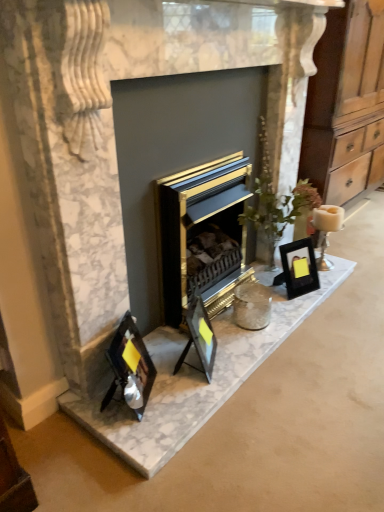
What is the approximate height of black glass photo frames at lower left?

The height of black glass photo frames at lower left is 10.00 centimeters.

I want to click on black glass photo frames at lower left, so click(194, 380).

What do you see at coordinates (130, 367) in the screenshot? I see `metallic silver photo frame at lower left, which is the third picture frame in right-to-left order` at bounding box center [130, 367].

Locate an element on the screen. Image resolution: width=384 pixels, height=512 pixels. white ceramic candle at right is located at coordinates (326, 229).

Based on the photo, is matte black picture frame at center, acting as the 2th picture frame starting from the back, not near black glass photo frames at lower left?

No, matte black picture frame at center, acting as the 2th picture frame starting from the back, is in close proximity to black glass photo frames at lower left.

Is matte black picture frame at center, the 2th picture frame from the left, bigger than black glass photo frames at lower left?

Correct, matte black picture frame at center, the 2th picture frame from the left, is larger in size than black glass photo frames at lower left.

How different are the orientations of matte black picture frame at center, the 2th picture frame from the right, and black glass photo frames at lower left in degrees?

They differ by 28.7 degrees in their facing directions.

Considering the positions of objects matte black picture frame at center, placed as the second picture frame when sorted from front to back, and black glass photo frames at lower left in the image provided, who is more to the left, matte black picture frame at center, placed as the second picture frame when sorted from front to back, or black glass photo frames at lower left?

From the viewer's perspective, black glass photo frames at lower left appears more on the left side.

Is black glass photo frame at center, which is the 3th picture frame in front-to-back order, spatially inside gold metallic fireplace at center, or outside of it?

The correct answer is: outside.

From the image's perspective, is black glass photo frame at center, the 3th picture frame positioned from the left, located above or below gold metallic fireplace at center?

black glass photo frame at center, the 3th picture frame positioned from the left, is situated lower than gold metallic fireplace at center in the image.

Can you tell me how much black glass photo frame at center, the 3th picture frame positioned from the left, and gold metallic fireplace at center differ in facing direction?

The angle between the facing direction of black glass photo frame at center, the 3th picture frame positioned from the left, and the facing direction of gold metallic fireplace at center is 21.2 degrees.

Is black glass photo frame at center, which appears as the 1th picture frame when viewed from the right, taller than gold metallic fireplace at center?

No, black glass photo frame at center, which appears as the 1th picture frame when viewed from the right, is not taller than gold metallic fireplace at center.

From a real-world perspective, is matte black picture frame at center, the 2th picture frame from the left, on gold metallic fireplace at center?

No.

Is matte black picture frame at center, the 2th picture frame from the right, aimed at gold metallic fireplace at center?

No, matte black picture frame at center, the 2th picture frame from the right, is not aimed at gold metallic fireplace at center.

Could you tell me if white ceramic candle at right is turned towards matte black picture frame at center, the 2th picture frame from the right?

No.

Considering their positions, is white ceramic candle at right located in front of or behind matte black picture frame at center, acting as the 2th picture frame starting from the back?

In the image, white ceramic candle at right appears behind matte black picture frame at center, acting as the 2th picture frame starting from the back.

From a real-world perspective, who is located higher, white ceramic candle at right or matte black picture frame at center, placed as the second picture frame when sorted from front to back?

white ceramic candle at right, from a real-world perspective.

Is white ceramic candle at right positioned beyond the bounds of matte black picture frame at center, the 2th picture frame from the left?

Yes, white ceramic candle at right is located beyond the bounds of matte black picture frame at center, the 2th picture frame from the left.

Is black glass photo frames at lower left not within black glass photo frame at center, which appears as the 1th picture frame when viewed from the right?

Absolutely, black glass photo frames at lower left is external to black glass photo frame at center, which appears as the 1th picture frame when viewed from the right.

From the image's perspective, is black glass photo frames at lower left located above or below black glass photo frame at center, which appears as the 1th picture frame when viewed from the right?

Based on their image positions, black glass photo frames at lower left is located beneath black glass photo frame at center, which appears as the 1th picture frame when viewed from the right.

Which object is positioned more to the right, black glass photo frames at lower left or black glass photo frame at center, which appears as the 1th picture frame when viewed from the right?

black glass photo frame at center, which appears as the 1th picture frame when viewed from the right.

Considering the sizes of black glass photo frames at lower left and black glass photo frame at center, which appears as the 1th picture frame when viewed from the right, in the image, is black glass photo frames at lower left bigger or smaller than black glass photo frame at center, which appears as the 1th picture frame when viewed from the right,?

In the image, black glass photo frames at lower left appears to be smaller than black glass photo frame at center, which appears as the 1th picture frame when viewed from the right.

Is metallic silver photo frame at lower left, arranged as the first picture frame when viewed from the front, touching wooden dresser at right?

metallic silver photo frame at lower left, arranged as the first picture frame when viewed from the front, and wooden dresser at right are clearly separated.

Is metallic silver photo frame at lower left, arranged as the first picture frame when viewed from the front, turned away from wooden dresser at right?

No, metallic silver photo frame at lower left, arranged as the first picture frame when viewed from the front, is not facing away from wooden dresser at right.

The height and width of the screenshot is (512, 384). Find the location of `the 3rd picture frame positioned below the wooden dresser at right (from the image's perspective)`. the 3rd picture frame positioned below the wooden dresser at right (from the image's perspective) is located at coordinates (130, 367).

Considering the positions of objects metallic silver photo frame at lower left, the 3th picture frame in the back-to-front sequence, and wooden dresser at right in the image provided, who is more to the right, metallic silver photo frame at lower left, the 3th picture frame in the back-to-front sequence, or wooden dresser at right?

From the viewer's perspective, wooden dresser at right appears more on the right side.

From a real-world perspective, is wooden dresser at right located beneath gold metallic fireplace at center?

No, from a real-world perspective, wooden dresser at right is not under gold metallic fireplace at center.

Is wooden dresser at right behind gold metallic fireplace at center?

Yes, it is.

Are wooden dresser at right and gold metallic fireplace at center far apart?

Actually, wooden dresser at right and gold metallic fireplace at center are a little close together.

From the image's perspective, is wooden dresser at right on gold metallic fireplace at center?

Correct, wooden dresser at right appears higher than gold metallic fireplace at center in the image.

The height and width of the screenshot is (512, 384). I want to click on table that appears in front of the matte black picture frame at center, placed as the second picture frame when sorted from front to back, so click(194, 380).

The width and height of the screenshot is (384, 512). Identify the location of picture frame that appears behind the gold metallic fireplace at center. (298, 268).

Based on their spatial positions, is black glass photo frames at lower left or gold metallic fireplace at center closer to metallic silver photo frame at lower left, arranged as the first picture frame when viewed from the front?

The object closer to metallic silver photo frame at lower left, arranged as the first picture frame when viewed from the front, is black glass photo frames at lower left.

When comparing their distances from metallic silver photo frame at lower left, acting as the first picture frame starting from the left, does black glass photo frames at lower left or wooden dresser at right seem closer?

black glass photo frames at lower left.

Considering their positions, is black glass photo frame at center, which appears as the 1th picture frame when viewed from the right, positioned further to matte black picture frame at center, acting as the 2th picture frame starting from the back, than wooden dresser at right?

wooden dresser at right is positioned further to the anchor matte black picture frame at center, acting as the 2th picture frame starting from the back.

From the image, which object appears to be farther from matte black picture frame at center, placed as the second picture frame when sorted from front to back, black glass photo frames at lower left or metallic silver photo frame at lower left, which is the third picture frame in right-to-left order?

Among the two, metallic silver photo frame at lower left, which is the third picture frame in right-to-left order, is located further to matte black picture frame at center, placed as the second picture frame when sorted from front to back.

From the image, which object appears to be farther from black glass photo frames at lower left, gold metallic fireplace at center or wooden dresser at right?

Based on the image, wooden dresser at right appears to be further to black glass photo frames at lower left.

Estimate the real-world distances between objects in this image. Which object is further from gold metallic fireplace at center, white ceramic candle at right or black glass photo frames at lower left?

white ceramic candle at right is further to gold metallic fireplace at center.

Estimate the real-world distances between objects in this image. Which object is closer to black glass photo frame at center, the 3th picture frame positioned from the left, wooden dresser at right or matte black picture frame at center, the 2th picture frame from the left?

matte black picture frame at center, the 2th picture frame from the left, is closer to black glass photo frame at center, the 3th picture frame positioned from the left.

Based on their spatial positions, is matte black picture frame at center, placed as the second picture frame when sorted from front to back, or gold metallic fireplace at center further from black glass photo frames at lower left?

Among the two, gold metallic fireplace at center is located further to black glass photo frames at lower left.

Where is `picture frame between wooden dresser at right and matte black picture frame at center, the 2th picture frame from the right, in the up-down direction`? This screenshot has width=384, height=512. picture frame between wooden dresser at right and matte black picture frame at center, the 2th picture frame from the right, in the up-down direction is located at coordinates (298, 268).

The image size is (384, 512). What are the coordinates of `fireplace between black glass photo frames at lower left and black glass photo frame at center, which is the 3th picture frame in front-to-back order, from left to right` in the screenshot? It's located at (202, 236).

In order to click on fireplace located between black glass photo frames at lower left and white ceramic candle at right in the left-right direction in this screenshot , I will do `click(202, 236)`.

Where is `fireplace between wooden dresser at right and matte black picture frame at center, the 2th picture frame from the right, in the up-down direction`? This screenshot has width=384, height=512. fireplace between wooden dresser at right and matte black picture frame at center, the 2th picture frame from the right, in the up-down direction is located at coordinates (202, 236).